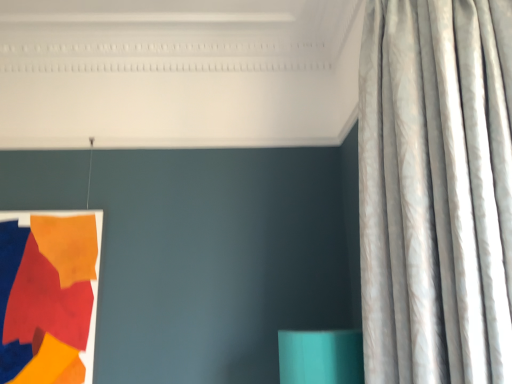
Question: Is matte fabric tapestry at left inside the boundaries of silvery textured curtain at right, or outside?

Choices:
 (A) outside
 (B) inside

Answer: (A)

Question: Looking at their shapes, would you say matte fabric tapestry at left is wider or thinner than silvery textured curtain at right?

Choices:
 (A) thin
 (B) wide

Answer: (A)

Question: Relative to silvery textured curtain at right, is matte fabric tapestry at left in front or behind?

Choices:
 (A) front
 (B) behind

Answer: (B)

Question: Looking at their shapes, would you say silvery textured curtain at right is wider or thinner than matte fabric tapestry at left?

Choices:
 (A) thin
 (B) wide

Answer: (B)

Question: Would you say silvery textured curtain at right is to the left or to the right of matte fabric tapestry at left in the picture?

Choices:
 (A) left
 (B) right

Answer: (B)

Question: In terms of height, does silvery textured curtain at right look taller or shorter compared to matte fabric tapestry at left?

Choices:
 (A) short
 (B) tall

Answer: (B)

Question: Is silvery textured curtain at right spatially inside matte fabric tapestry at left, or outside of it?

Choices:
 (A) outside
 (B) inside

Answer: (A)